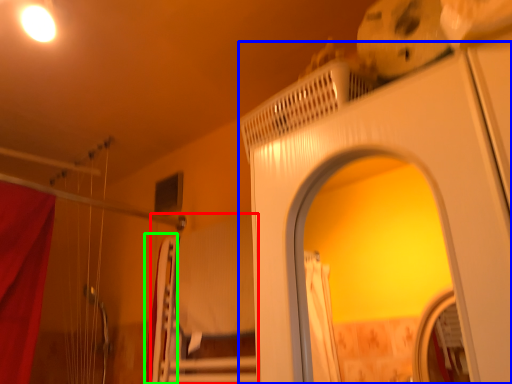
Question: Based on their relative distances, which object is nearer to bed (highlighted by a red box)? Choose from screen door (highlighted by a blue box) and curtain (highlighted by a green box).

Choices:
 (A) screen door
 (B) curtain

Answer: (B)